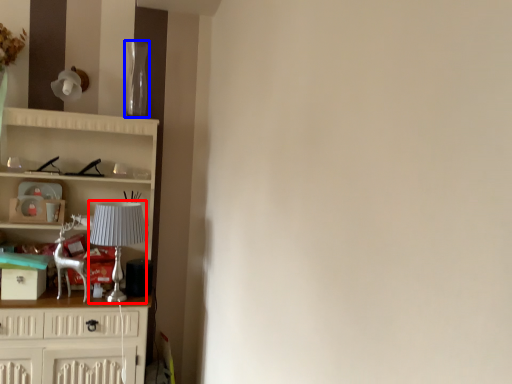
Question: Which object is further to the camera taking this photo, lamp (highlighted by a red box) or glass vase (highlighted by a blue box)?

Choices:
 (A) lamp
 (B) glass vase

Answer: (B)